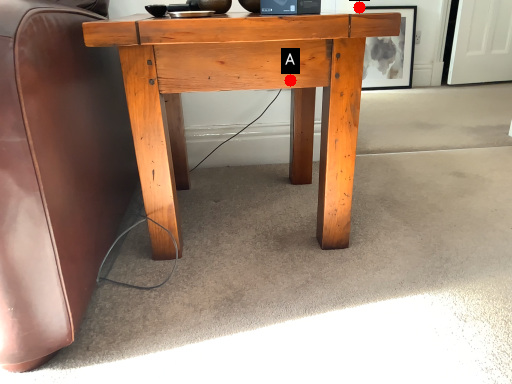
Question: Two points are circled on the image, labeled by A and B beside each circle. Which point is farther to the camera?

Choices:
 (A) A is further
 (B) B is further

Answer: (B)